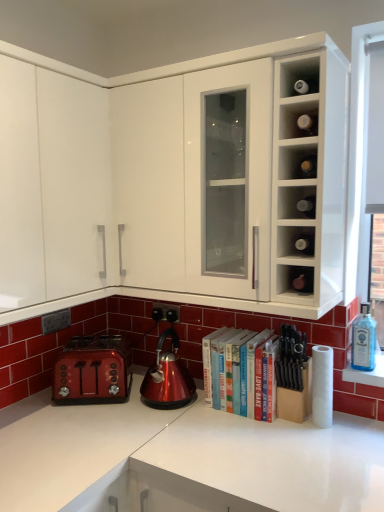
Question: Can you confirm if glossy metallic kettle at center is wider than white glossy cabinet at upper center, the 1th cabinetry when ordered from right to left?

Choices:
 (A) no
 (B) yes

Answer: (A)

Question: Can you confirm if glossy metallic kettle at center is smaller than white glossy cabinet at upper center, the 1th cabinetry when ordered from right to left?

Choices:
 (A) no
 (B) yes

Answer: (B)

Question: Considering the relative sizes of glossy metallic kettle at center and white glossy cabinet at upper center, the second cabinetry positioned from the left, in the image provided, is glossy metallic kettle at center shorter than white glossy cabinet at upper center, the second cabinetry positioned from the left,?

Choices:
 (A) yes
 (B) no

Answer: (A)

Question: From the image's perspective, is glossy metallic kettle at center below white glossy cabinet at upper center, the second cabinetry positioned from the left?

Choices:
 (A) no
 (B) yes

Answer: (B)

Question: Does glossy metallic kettle at center contain white glossy cabinet at upper center, the 1th cabinetry when ordered from right to left?

Choices:
 (A) no
 (B) yes

Answer: (A)

Question: Is glossy metallic kettle at center to the left of white glossy cabinet at upper center, the second cabinetry positioned from the left, from the viewer's perspective?

Choices:
 (A) yes
 (B) no

Answer: (A)

Question: Does shiny metallic toaster at lower left appear on the left side of matte glass wine bottles at upper right, marked as the 3th cabinet in a bottom-to-top arrangement?

Choices:
 (A) yes
 (B) no

Answer: (A)

Question: Considering the relative sizes of shiny metallic toaster at lower left and matte glass wine bottles at upper right, which ranks as the 1th cabinet in top-to-bottom order, in the image provided, is shiny metallic toaster at lower left bigger than matte glass wine bottles at upper right, which ranks as the 1th cabinet in top-to-bottom order,?

Choices:
 (A) no
 (B) yes

Answer: (B)

Question: Is shiny metallic toaster at lower left in contact with matte glass wine bottles at upper right, which ranks as the 1th cabinet in top-to-bottom order?

Choices:
 (A) no
 (B) yes

Answer: (A)

Question: From the image's perspective, is shiny metallic toaster at lower left above matte glass wine bottles at upper right, which ranks as the 1th cabinet in top-to-bottom order?

Choices:
 (A) yes
 (B) no

Answer: (B)

Question: From a real-world perspective, does shiny metallic toaster at lower left sit lower than matte glass wine bottles at upper right, marked as the 3th cabinet in a bottom-to-top arrangement?

Choices:
 (A) yes
 (B) no

Answer: (A)

Question: From a real-world perspective, is shiny metallic toaster at lower left on matte glass wine bottles at upper right, marked as the 3th cabinet in a bottom-to-top arrangement?

Choices:
 (A) yes
 (B) no

Answer: (B)

Question: Is white glossy cabinet at upper center, the second cabinetry positioned from the left, outside glossy metallic kettle at center?

Choices:
 (A) no
 (B) yes

Answer: (B)